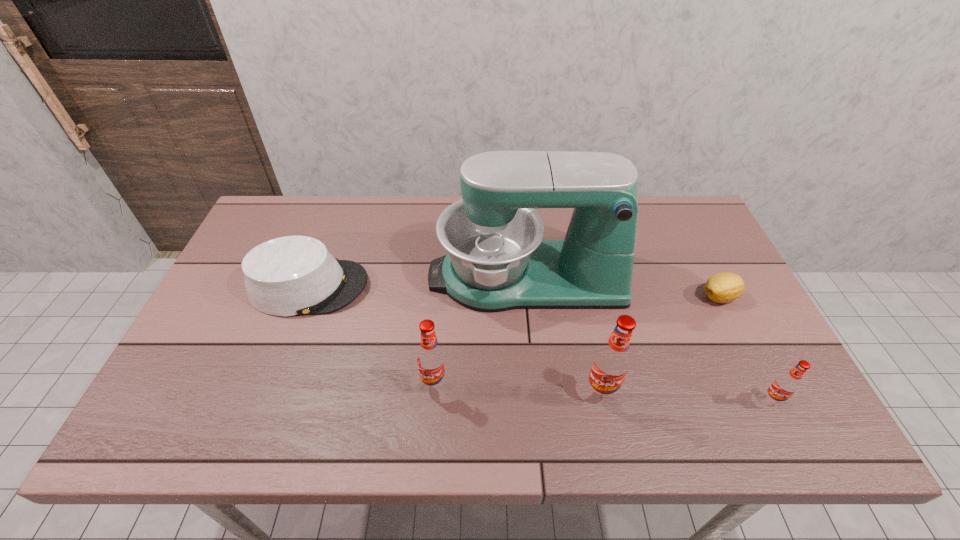
Identify the location of vacant point located 0.180m on the back of the second root beer from right to left. This screenshot has width=960, height=540. (586, 319).

In order to click on vacant space situated 0.280m on the back of the rightmost root beer in this screenshot , I will do `click(721, 301)`.

Locate an element on the screen. free location located on the front-facing side of the leftmost object is located at coordinates (407, 287).

You are a GUI agent. You are given a task and a screenshot of the screen. Output one action in this format:
    pyautogui.click(x=<x>, y=<y>)
    Task: Click on the vacant space located at the stem end of the lemon
    The height and width of the screenshot is (540, 960).
    Given the screenshot: What is the action you would take?
    pyautogui.click(x=656, y=297)

Locate an element on the screen. vacant space situated at the stem end of the lemon is located at coordinates (627, 297).

Locate an element on the screen. vacant region located at the stem end of the lemon is located at coordinates click(623, 297).

You are a GUI agent. You are given a task and a screenshot of the screen. Output one action in this format:
    pyautogui.click(x=<x>, y=<y>)
    Task: Click on the vacant space located 0.070m on the front-facing side of the tallest object
    The height and width of the screenshot is (540, 960).
    Given the screenshot: What is the action you would take?
    pyautogui.click(x=404, y=278)

Find the location of `vacant area situated 0.320m on the front-facing side of the tallest object`. vacant area situated 0.320m on the front-facing side of the tallest object is located at coordinates (318, 278).

Identify the location of vacant space located 0.160m on the front-facing side of the tallest object. This screenshot has width=960, height=540. pyautogui.click(x=373, y=278).

Locate an element on the screen. object present at the far edge is located at coordinates (497, 260).